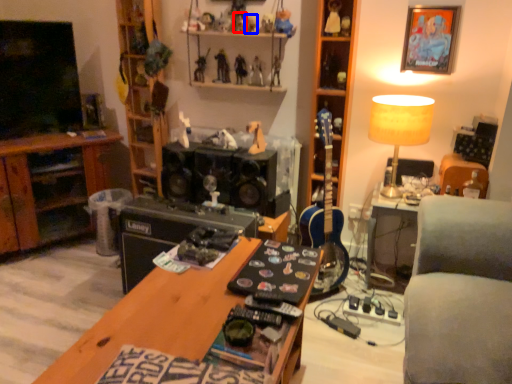
Question: Which of the following is the closest to the observer, toy (highlighted by a red box) or toy (highlighted by a blue box)?

Choices:
 (A) toy
 (B) toy

Answer: (A)